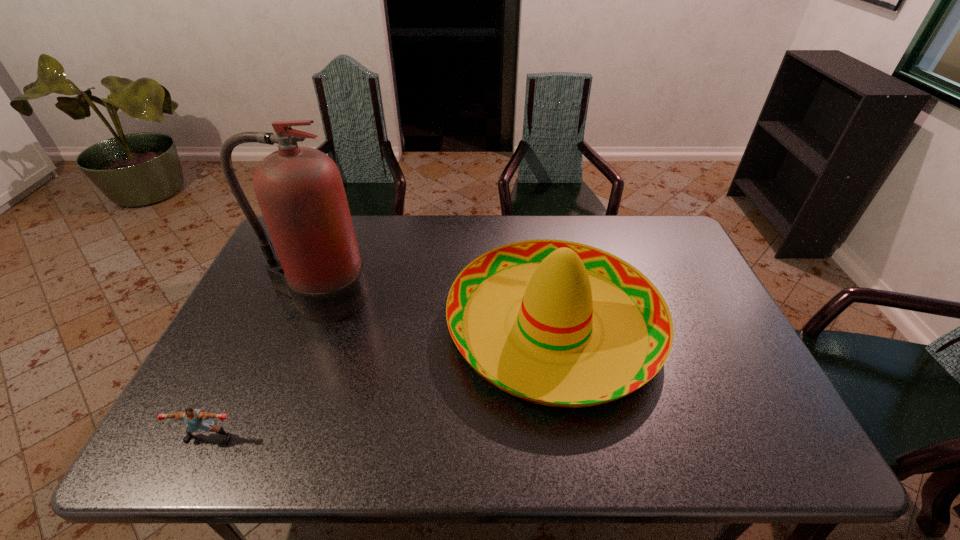
Find the location of a particular element. vacant area that lies between the puncher and the tallest object is located at coordinates (263, 367).

Image resolution: width=960 pixels, height=540 pixels. In order to click on empty space that is in between the sombrero and the puncher in this screenshot , I will do `click(381, 381)`.

You are a GUI agent. You are given a task and a screenshot of the screen. Output one action in this format:
    pyautogui.click(x=<x>, y=<y>)
    Task: Click on the vacant point located between the rightmost object and the fire extinguisher
    The image size is (960, 540).
    Given the screenshot: What is the action you would take?
    pyautogui.click(x=436, y=310)

Identify the location of vacant space that is in between the nearest object and the sombrero. The image size is (960, 540). (381, 381).

You are a GUI agent. You are given a task and a screenshot of the screen. Output one action in this format:
    pyautogui.click(x=<x>, y=<y>)
    Task: Click on the vacant area that lies between the rightmost object and the nearest object
    The height and width of the screenshot is (540, 960).
    Given the screenshot: What is the action you would take?
    pyautogui.click(x=381, y=381)

The height and width of the screenshot is (540, 960). Identify the location of unoccupied area between the tallest object and the puncher. (263, 367).

Image resolution: width=960 pixels, height=540 pixels. I want to click on free spot between the sombrero and the tallest object, so point(436,310).

Find the location of a particular element. object that is the nearest to the tallest object is located at coordinates (591, 328).

The width and height of the screenshot is (960, 540). What are the coordinates of `object that can be found as the closest to the rightmost object` in the screenshot? It's located at (300, 191).

Locate an element on the screen. vacant point that satisfies the following two spatial constraints: 1. at the nozzle of the tallest object; 2. on the right side of the rightmost object is located at coordinates (306, 326).